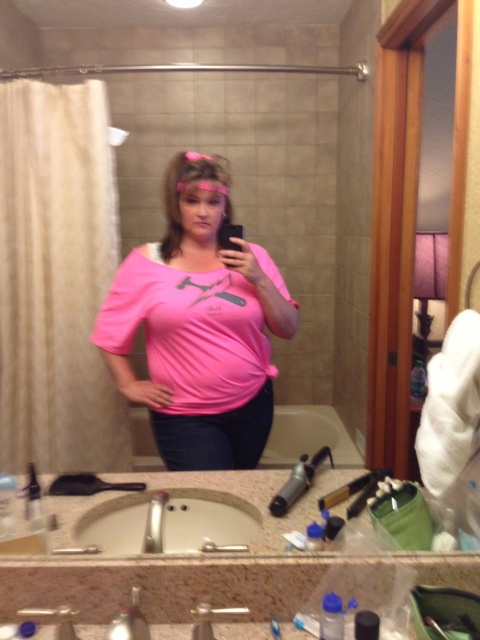
Question: Which point is closer to the camera taking this photo?

Choices:
 (A) (206, 496)
 (B) (249, 288)

Answer: (A)

Question: Can you confirm if pink matte shirt at center is bigger than black plastic brush at lower left?

Choices:
 (A) no
 (B) yes

Answer: (B)

Question: Estimate the real-world distances between objects in this image. Which object is farther from the black plastic brush at lower left?

Choices:
 (A) pink matte shirt at center
 (B) white ceramic sink at lower center

Answer: (A)

Question: Is the position of pink matte shirt at center less distant than that of white ceramic sink at lower center?

Choices:
 (A) yes
 (B) no

Answer: (B)

Question: Does pink matte shirt at center appear on the left side of white ceramic sink at lower center?

Choices:
 (A) no
 (B) yes

Answer: (B)

Question: Which is nearer to the pink matte shirt at center?

Choices:
 (A) white ceramic sink at lower center
 (B) black plastic brush at lower left

Answer: (A)